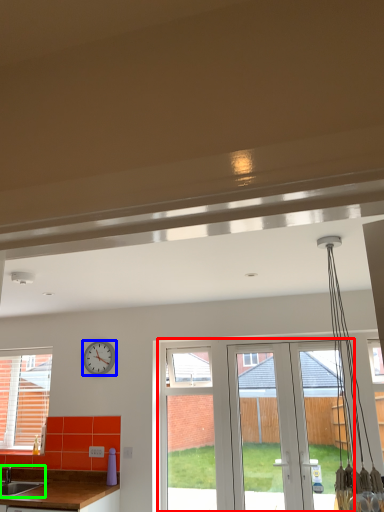
Question: Estimate the real-world distances between objects in this image. Which object is farther from screen door (highlighted by a red box), clock (highlighted by a blue box) or sink (highlighted by a green box)?

Choices:
 (A) clock
 (B) sink

Answer: (B)